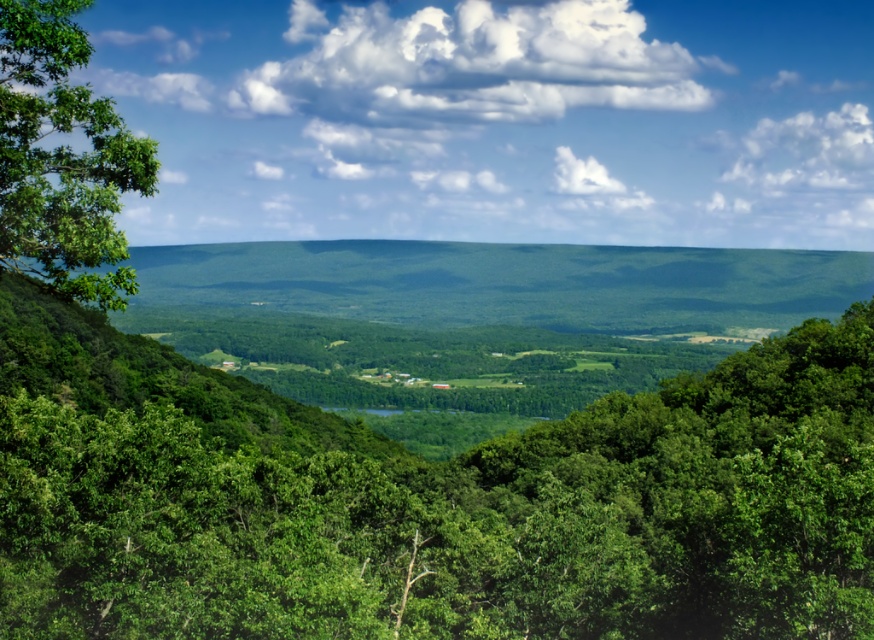
Question: Can you confirm if green leafy tree at center is smaller than white fluffy cloud at upper center?

Choices:
 (A) yes
 (B) no

Answer: (A)

Question: Which object appears farthest from the camera in this image?

Choices:
 (A) green leafy tree at left
 (B) white fluffy cloud at upper center

Answer: (B)

Question: Which point is closer to the camera taking this photo?

Choices:
 (A) (165, 4)
 (B) (28, 42)
 (C) (565, 424)

Answer: (B)

Question: Which point is farther to the camera?

Choices:
 (A) white fluffy cloud at upper center
 (B) green leafy tree at left
 (C) green leafy tree at center

Answer: (C)

Question: Does white fluffy cloud at upper center appear under green leafy tree at left?

Choices:
 (A) no
 (B) yes

Answer: (A)

Question: Considering the relative positions of white fluffy cloud at upper center and green leafy tree at left in the image provided, where is white fluffy cloud at upper center located with respect to green leafy tree at left?

Choices:
 (A) left
 (B) right

Answer: (B)